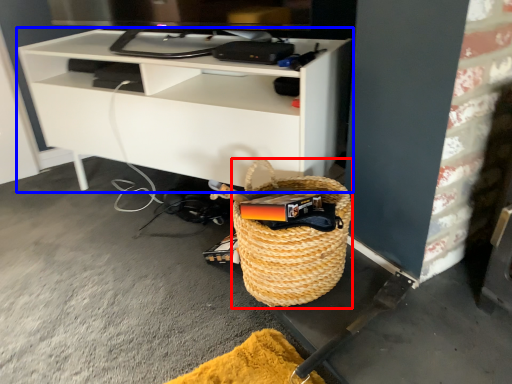
Question: Which object appears closest to the camera in this image, basket (highlighted by a red box) or shelf (highlighted by a blue box)?

Choices:
 (A) basket
 (B) shelf

Answer: (A)